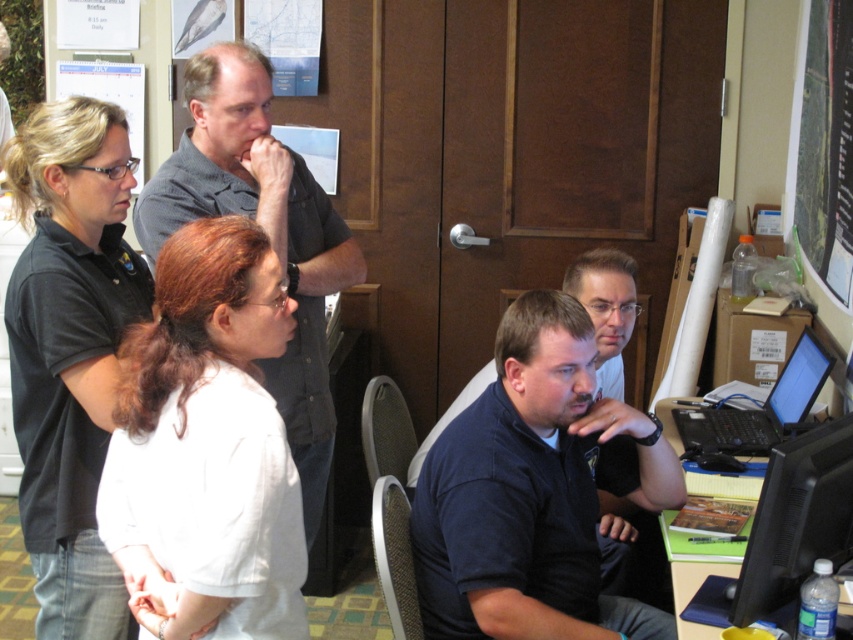
Question: Is dark blue shirt at center wider than gray shirt at upper center?

Choices:
 (A) no
 (B) yes

Answer: (B)

Question: Which of the following is the closest to the observer?

Choices:
 (A) black plastic laptop at right
 (B) white paperboard at right
 (C) white matte shirt at left

Answer: (C)

Question: Can you confirm if black shirt at upper left is smaller than black glossy monitor at lower right?

Choices:
 (A) yes
 (B) no

Answer: (B)

Question: Among these objects, which one is farthest from the camera?

Choices:
 (A) black plastic laptop at right
 (B) dark blue shirt at center
 (C) gray shirt at upper center
 (D) white matte shirt at left

Answer: (A)

Question: Can you confirm if dark blue shirt at center is positioned to the left of black glossy monitor at lower right?

Choices:
 (A) no
 (B) yes

Answer: (B)

Question: Which of these objects is positioned farthest from the black plastic laptop at right?

Choices:
 (A) black shirt at upper left
 (B) white matte shirt at left

Answer: (A)